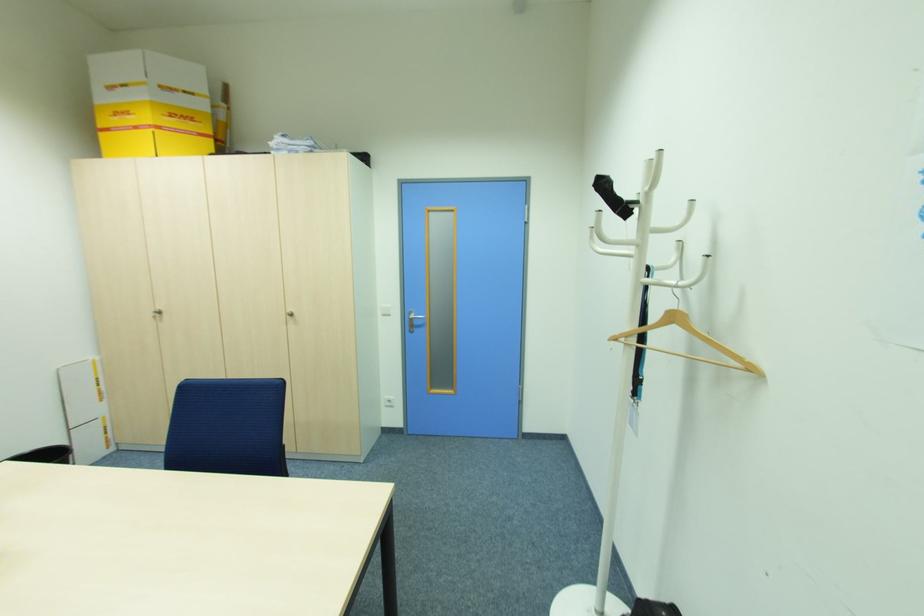
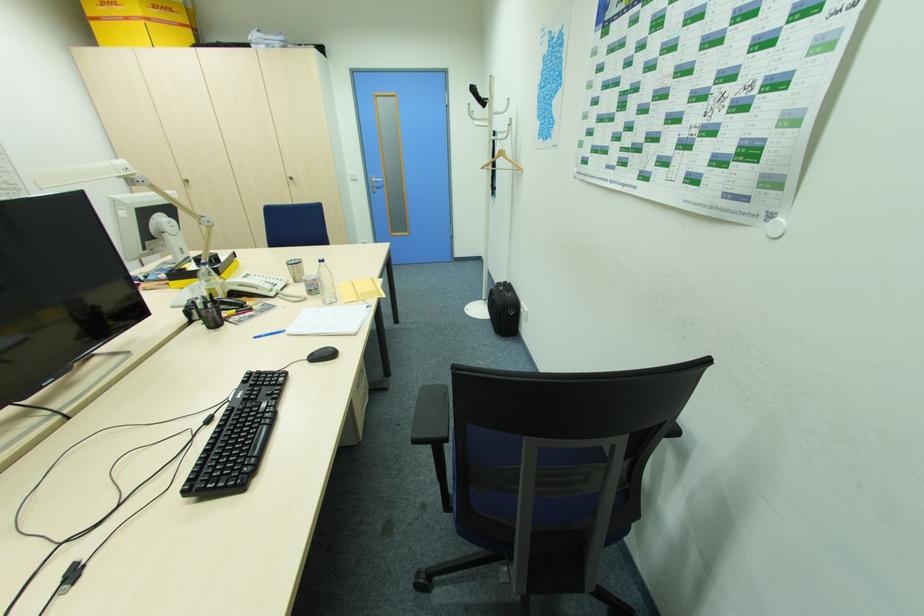
Question: In a continuous first-person perspective shot, in which direction is the camera moving?

Choices:
 (A) Left
 (B) Right
 (C) Forward
 (D) Backward

Answer: (D)